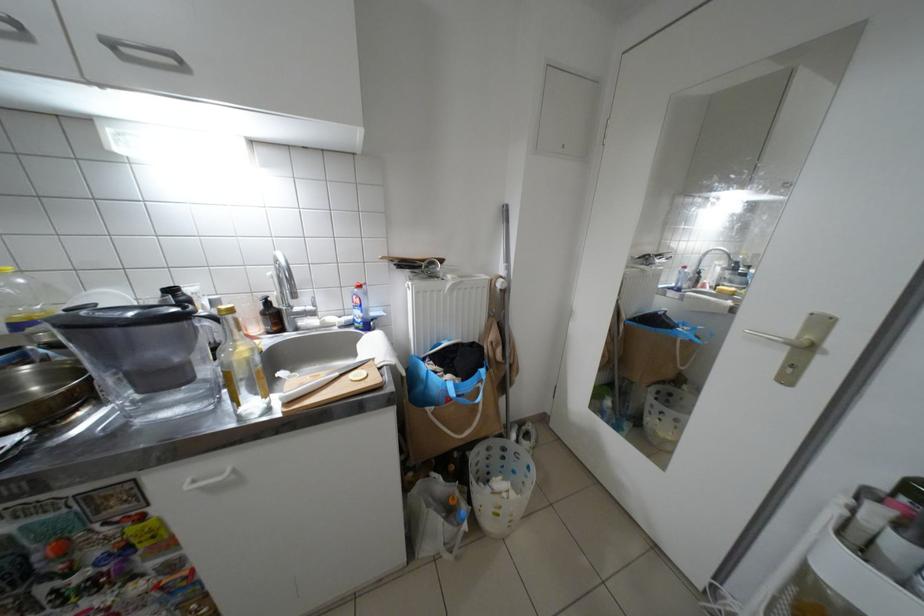
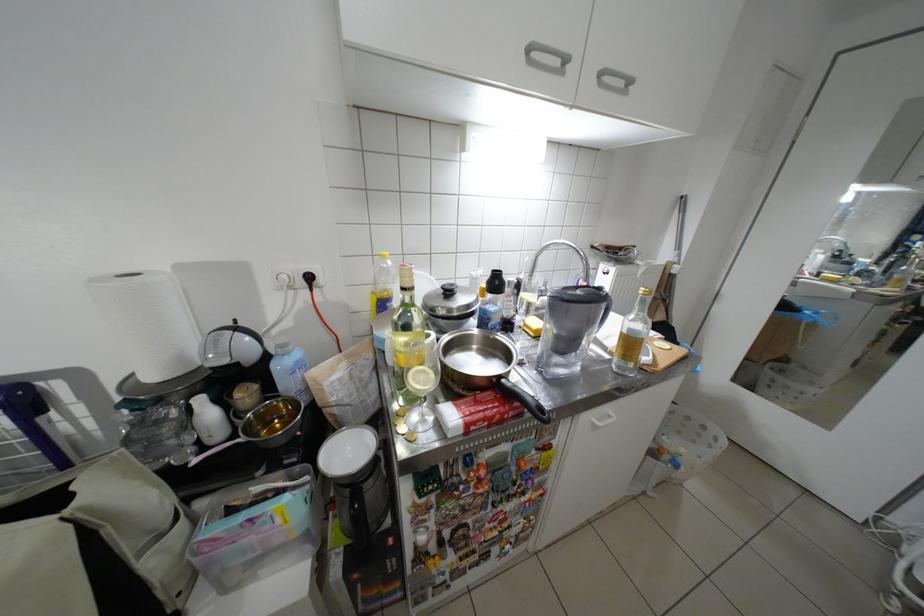
The point at (x=33, y=281) is marked in the first image. Where is the corresponding point in the second image?

(400, 264)